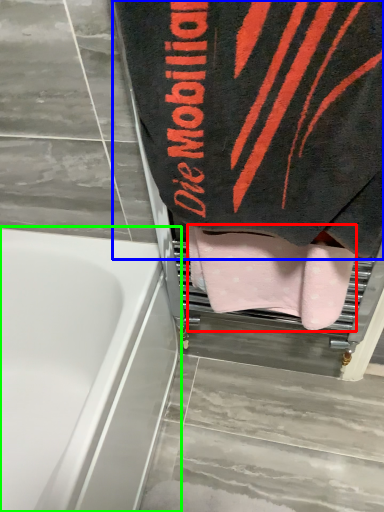
Question: Which is nearer to the towel (highlighted by a red box)? towel (highlighted by a blue box) or bathtub (highlighted by a green box).

Choices:
 (A) towel
 (B) bathtub

Answer: (A)